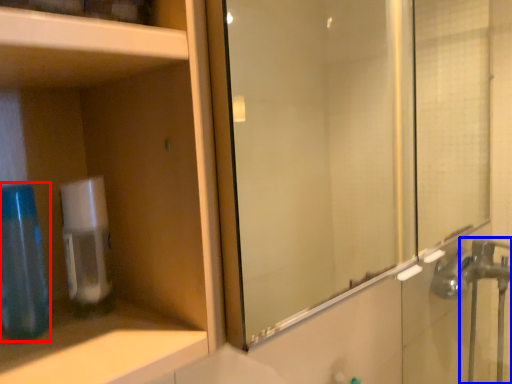
Question: Which of the following is the farthest to the observer, mouthwash (highlighted by a red box) or faucet (highlighted by a blue box)?

Choices:
 (A) mouthwash
 (B) faucet

Answer: (B)